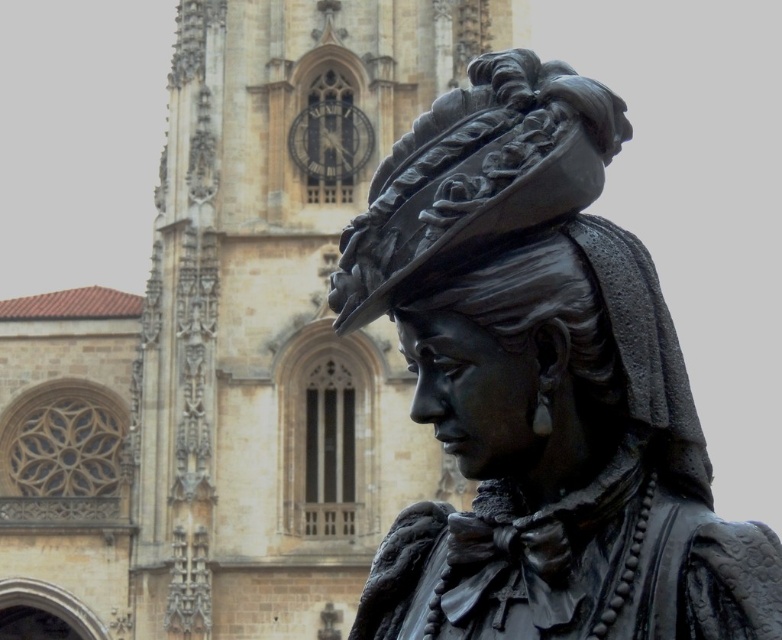
Question: Is beige stone church at center to the right of black polished statue at center from the viewer's perspective?

Choices:
 (A) no
 (B) yes

Answer: (A)

Question: Which point is closer to the camera taking this photo?

Choices:
 (A) (357, 460)
 (B) (357, 314)

Answer: (B)

Question: Is beige stone church at center to the left of black polished statue at center from the viewer's perspective?

Choices:
 (A) no
 (B) yes

Answer: (B)

Question: From the image, what is the correct spatial relationship of beige stone church at center in relation to black polished statue at center?

Choices:
 (A) above
 (B) below

Answer: (A)